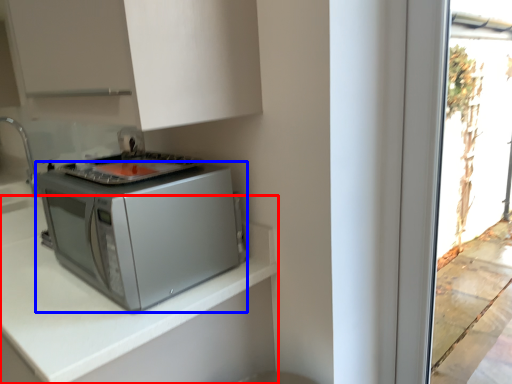
Question: Which object appears farthest to the camera in this image, countertop (highlighted by a red box) or home appliance (highlighted by a blue box)?

Choices:
 (A) countertop
 (B) home appliance

Answer: (B)